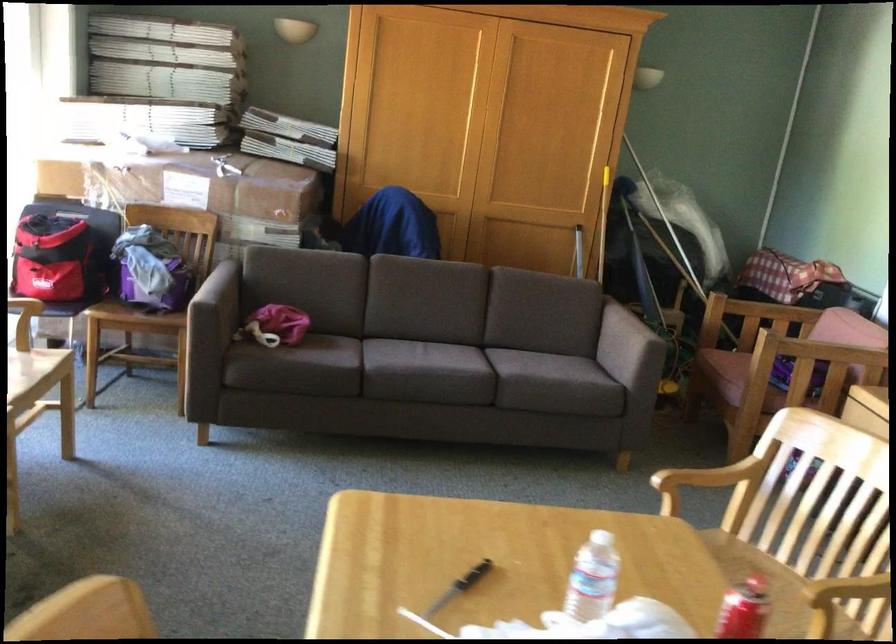
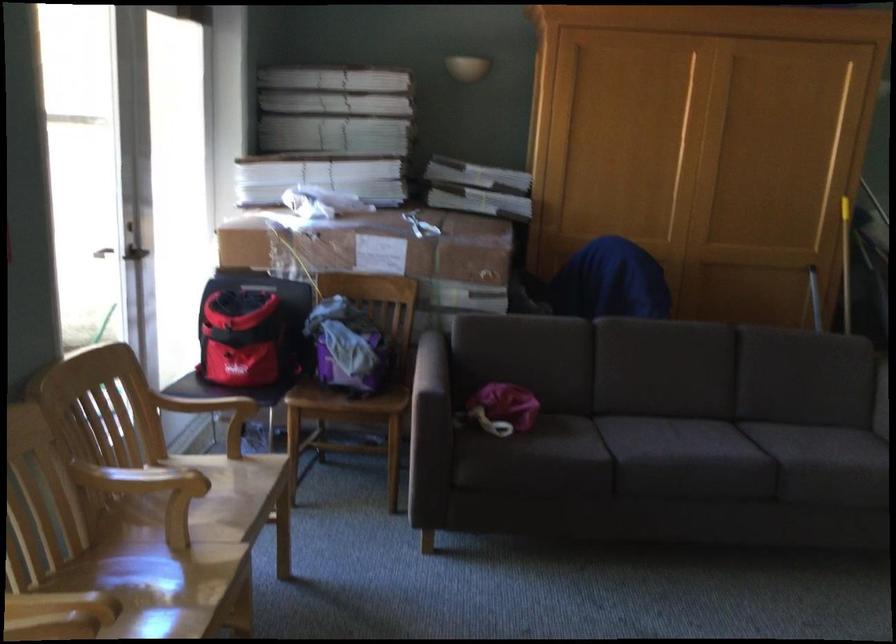
Find the pixel in the second image that matches [276,327] in the first image.

(503, 408)